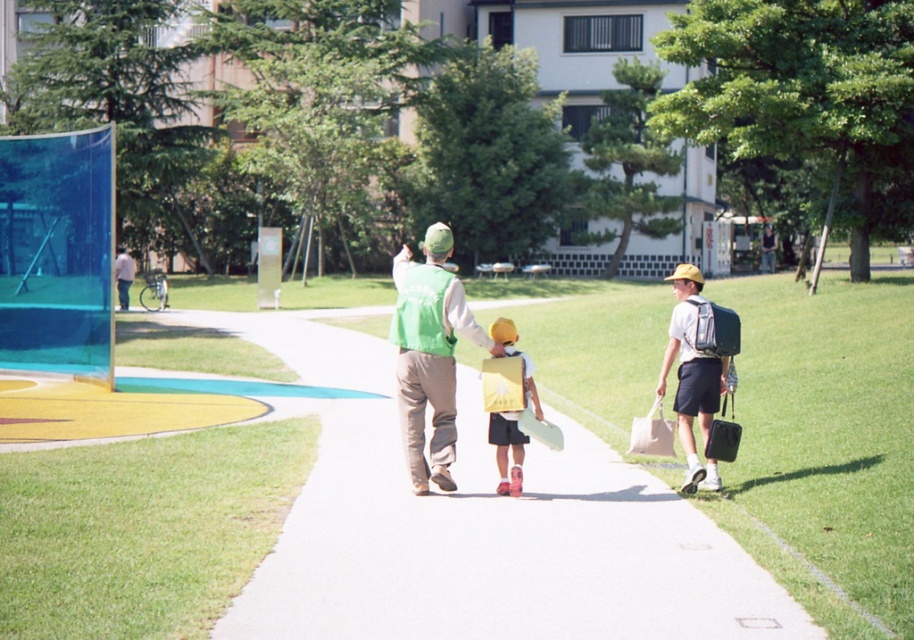
You are a fashion designer observing the two green vests in the scene. Which one is taller, the matte green vest at center or the green fabric vest at center?

The matte green vest at center is taller than the green fabric vest at center according to the description.

You are a tailor who needs to determine which of the two vests, the matte green vest at center or the green fabric vest at center, requires more fabric to make based on their widths. Which vest would need more fabric?

The matte green vest at center requires more fabric because its width surpasses that of the green fabric vest at center.